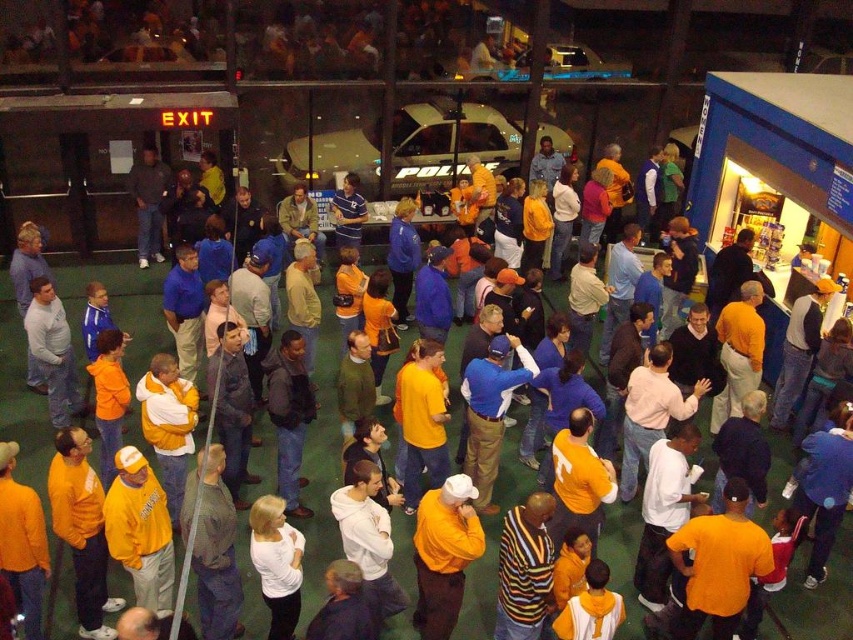
Question: Which point appears closest to the camera in this image?

Choices:
 (A) (473, 548)
 (B) (265, 572)

Answer: (B)

Question: Can you confirm if matte yellow shirt at center is wider than white matte shirt at center?

Choices:
 (A) yes
 (B) no

Answer: (A)

Question: Is matte yellow shirt at center smaller than white matte shirt at center?

Choices:
 (A) yes
 (B) no

Answer: (B)

Question: Which of the following is the closest to the observer?

Choices:
 (A) (422, 636)
 (B) (270, 573)

Answer: (B)

Question: Can you confirm if matte yellow shirt at center is positioned to the right of white matte shirt at center?

Choices:
 (A) yes
 (B) no

Answer: (A)